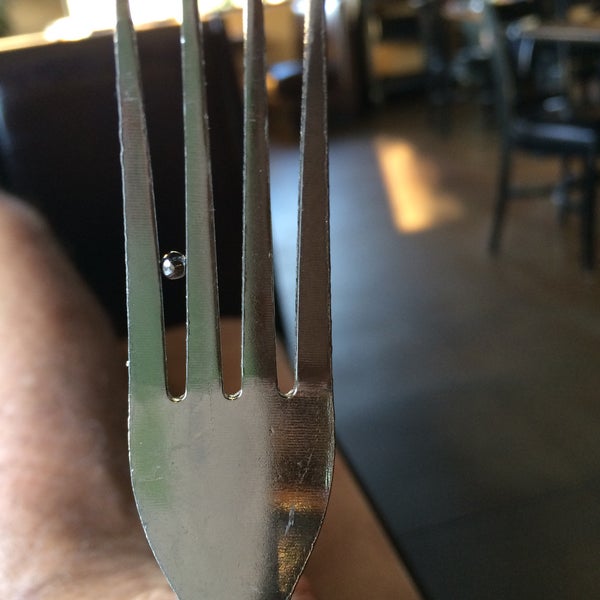
At what (x,y) coordinates should I click in order to perform the action: click on floor. Please return your answer as a coordinate pair (x, y). Looking at the image, I should click on pyautogui.click(x=506, y=474).